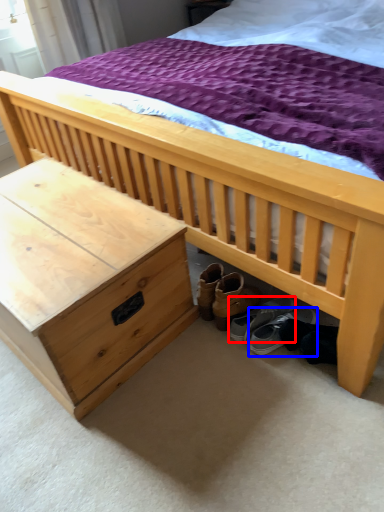
Question: Which point is further to the camera, footwear (highlighted by a red box) or footwear (highlighted by a blue box)?

Choices:
 (A) footwear
 (B) footwear

Answer: (A)